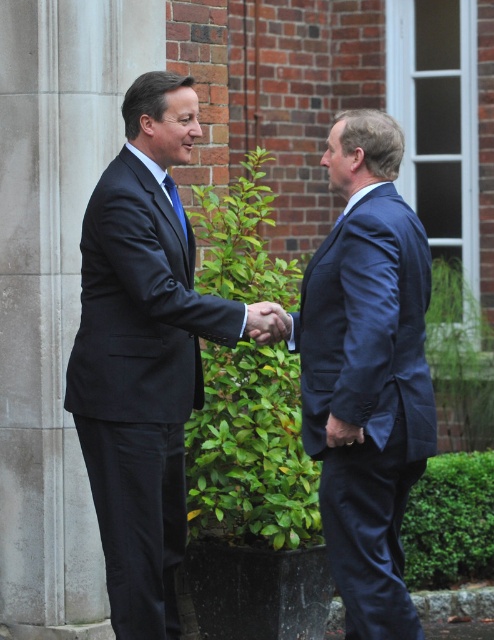
Where is `matte black suit at center`? matte black suit at center is located at coordinates (145, 355).

Does point (120, 602) lie behind point (354, 115)?

No, (120, 602) is closer to viewer.

In order to click on matte black suit at center in this screenshot , I will do (145, 355).

Who is positioned more to the right, navy blue suit at center or blue silk tie at center?

Positioned to the right is navy blue suit at center.

Can you confirm if navy blue suit at center is positioned above blue silk tie at center?

Incorrect, navy blue suit at center is not positioned above blue silk tie at center.

Where is `navy blue suit at center`? navy blue suit at center is located at coordinates (367, 372).

Locate an element on the screen. This screenshot has height=640, width=494. navy blue suit at center is located at coordinates (367, 372).

Does matte black suit at center have a greater height compared to blue silk tie at center?

Indeed, matte black suit at center has a greater height compared to blue silk tie at center.

Between matte black suit at center and blue silk tie at center, which one appears on the left side from the viewer's perspective?

From the viewer's perspective, blue silk tie at center appears more on the left side.

Identify the location of matte black suit at center. The width and height of the screenshot is (494, 640). (145, 355).